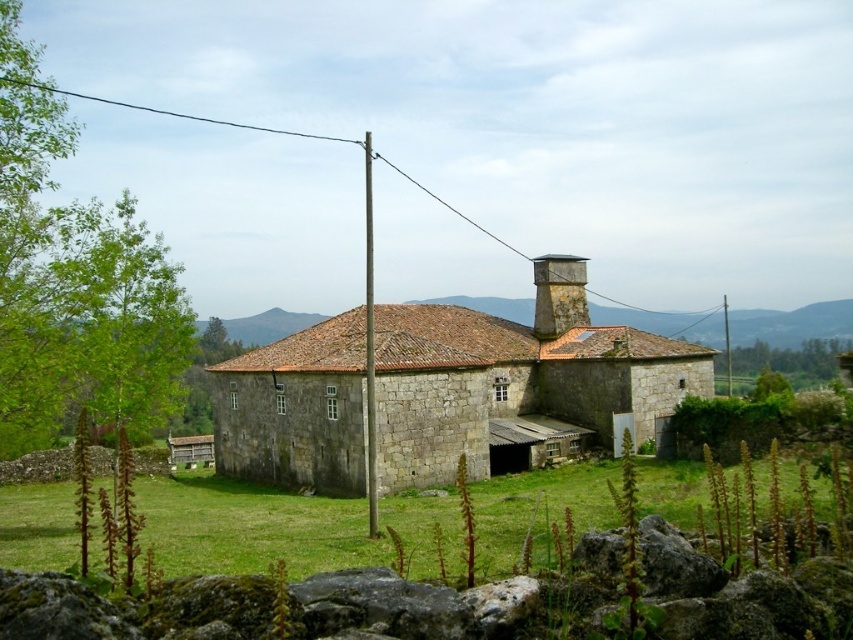
Is green grass at lower center taller than stone chimney at upper center?

Incorrect, green grass at lower center's height is not larger of stone chimney at upper center's.

Does green grass at lower center have a greater width compared to stone chimney at upper center?

Yes, green grass at lower center is wider than stone chimney at upper center.

Is point (485, 568) more distant than point (578, 257)?

That is False.

The width and height of the screenshot is (853, 640). I want to click on green grass at lower center, so click(250, 528).